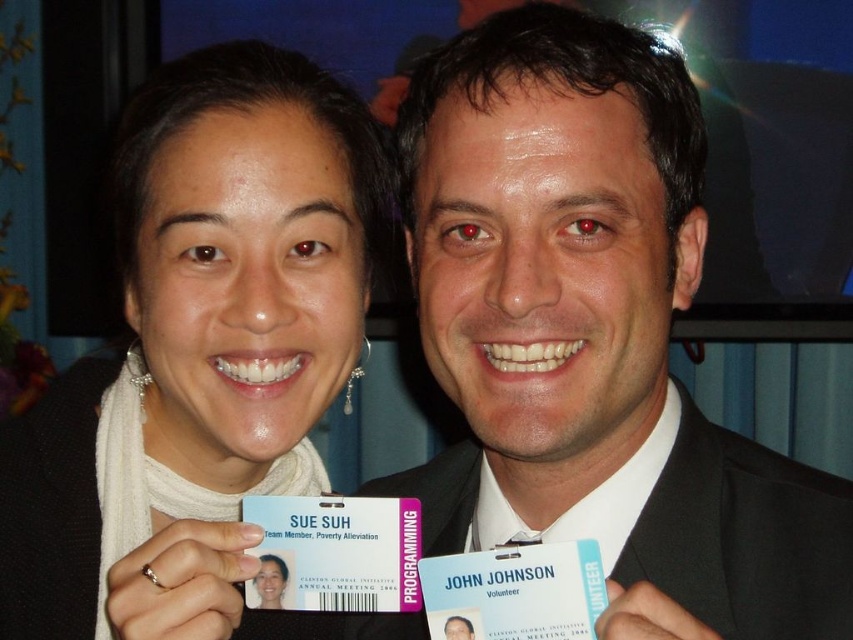
You are a photographer setting up for a group photo. You notice the black suit at center and the matte white scarf at upper left in the frame. Given that the minimum focus distance for your camera is 30 centimeters, will both subjects be in focus?

The distance between the black suit at center and the matte white scarf at upper left is 30.60 centimeters. Since this distance exceeds the camera minimum focus distance of 30 centimeters, both subjects will be in focus.

Where is the black suit at center located in the image?

The black suit at center is located at point 0.527 on the x axis and 0.696 on the y axis.